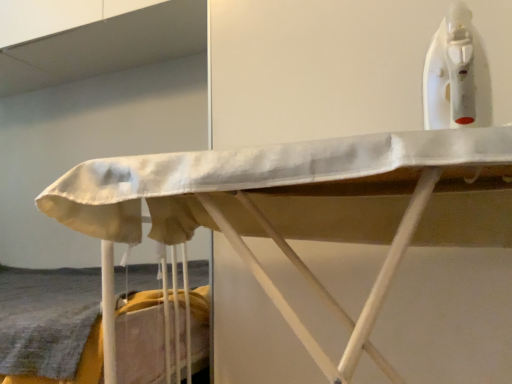
What is the approximate height of white plastic iron at upper right?

white plastic iron at upper right is 10.49 inches in height.

In order to face white plastic iron at upper right, should I rotate leftwards or rightwards?

Turn right approximately 25.724 degrees to face it.

Describe the element at coordinates (456, 75) in the screenshot. I see `white plastic iron at upper right` at that location.

At what (x,y) coordinates should I click in order to perform the action: click on white plastic iron at upper right. Please return your answer as a coordinate pair (x, y). Image resolution: width=512 pixels, height=384 pixels. Looking at the image, I should click on (456, 75).

Find the location of a particular element. white plastic iron at upper right is located at coordinates (456, 75).